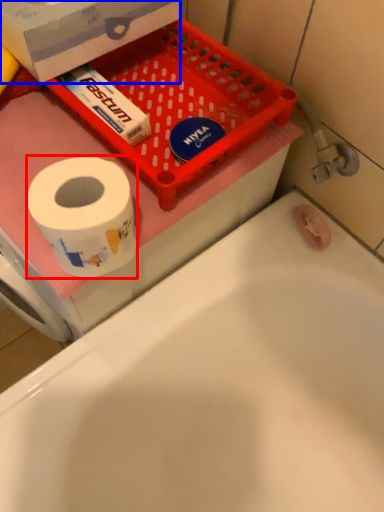
Question: Among these objects, which one is nearest to the camera, toilet paper (highlighted by a red box) or box (highlighted by a blue box)?

Choices:
 (A) toilet paper
 (B) box

Answer: (A)